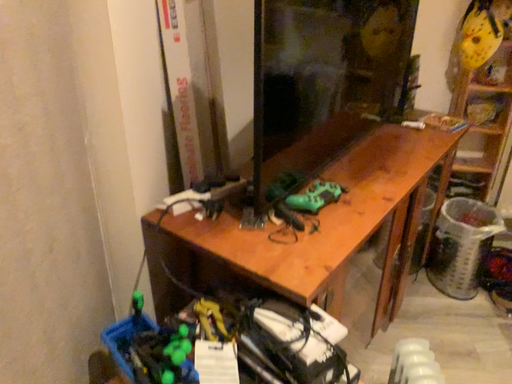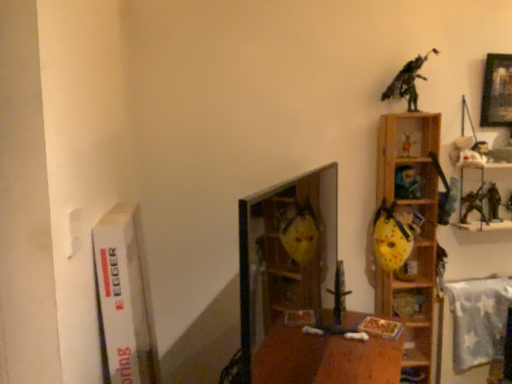
Question: Which way did the camera rotate in the video?

Choices:
 (A) rotated upward
 (B) rotated downward

Answer: (A)